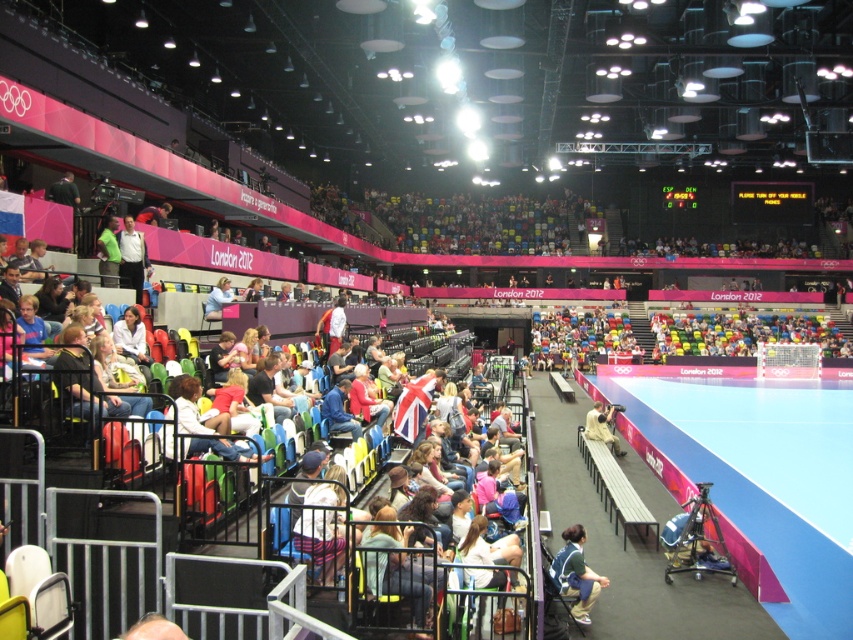
You are a photographer standing at the edge of the blue floor in the foreground of the arena. You want to take a photo of both the khaki fabric jacket at center and the light blue shirt at center. Which one should you focus on first to ensure it appears sharp in your photo?

The khaki fabric jacket at center is closer to you, so you should focus on it first to ensure it appears sharp in your photo.

You are a photographer standing at the edge of the blue floor near the camera tripod. You want to take a photo that includes both the white fabric jacket at center and the light blue shirt at center. Which clothing item will appear larger in the photo?

The white fabric jacket at center will appear larger in the photo because it is bigger than the light blue shirt at center.